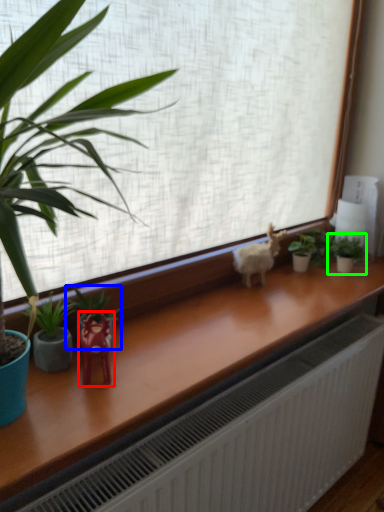
Question: Considering the real-world distances, which object is closest to miniature (highlighted by a red box)? houseplant (highlighted by a blue box) or houseplant (highlighted by a green box).

Choices:
 (A) houseplant
 (B) houseplant

Answer: (A)